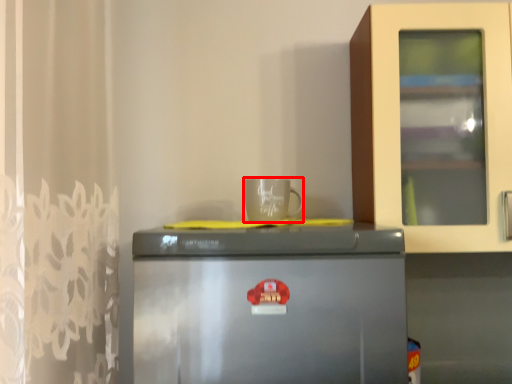
Question: From the image's perspective, what is the correct spatial relationship of coffee cup (annotated by the red box) in relation to refrigerator?

Choices:
 (A) below
 (B) above

Answer: (B)